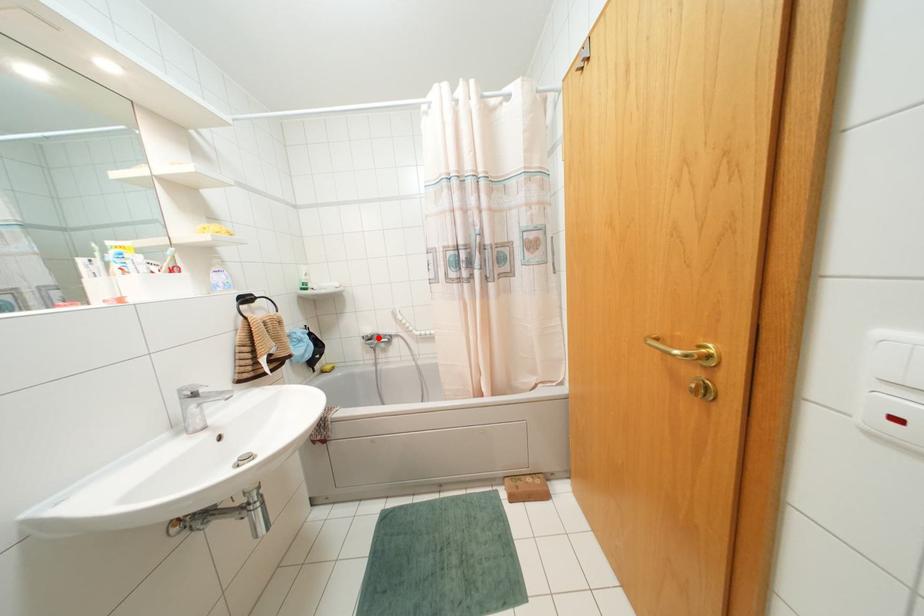
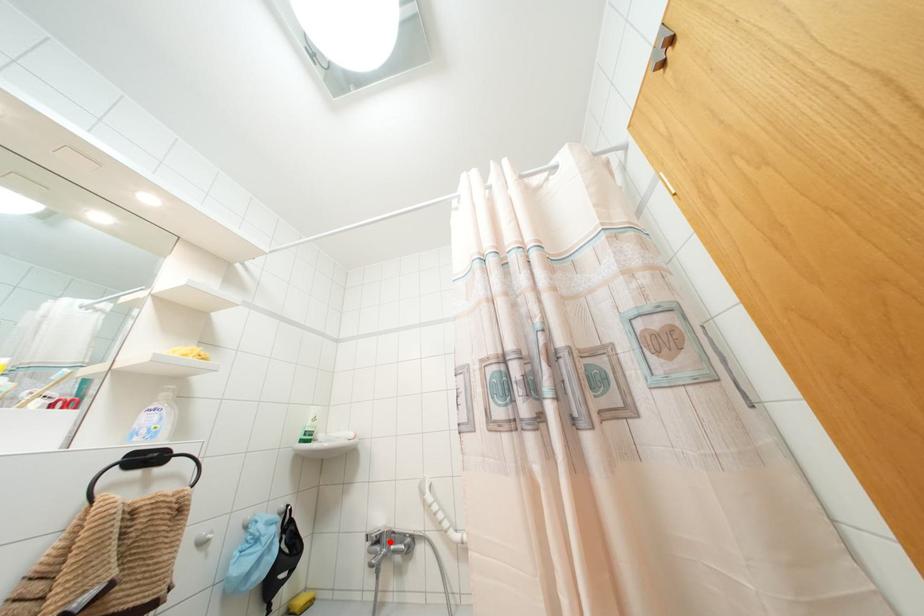
I am providing you with two images of the same scene from different viewpoints. A red point is marked on the first image and another point is marked on the second image. Do the highlighted points in image1 and image2 indicate the same real-world spot?

Yes